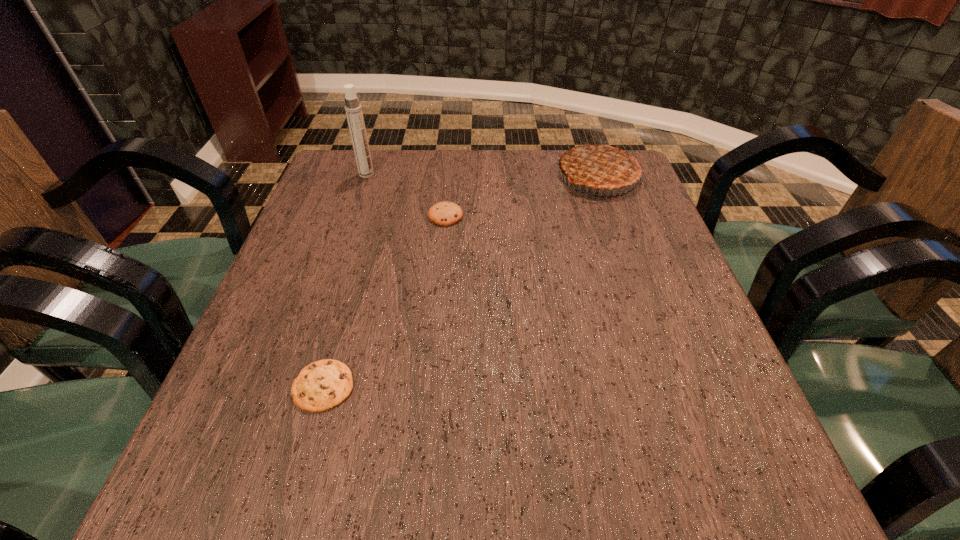
What are the coordinates of `free area in between the tallest object and the third tallest object` in the screenshot? It's located at (406, 195).

Where is `vacant region between the left cookie and the farther cookie`? This screenshot has width=960, height=540. vacant region between the left cookie and the farther cookie is located at coordinates pos(385,301).

This screenshot has width=960, height=540. In order to click on unoccupied area between the aerosol can and the pie in this screenshot , I will do `click(482, 176)`.

The width and height of the screenshot is (960, 540). I want to click on the closest object to the shorter cookie, so click(446, 213).

Identify the location of object that is the second closest to the tallest object. (604, 165).

The image size is (960, 540). Find the location of `free spot that satisfies the following two spatial constraints: 1. on the back side of the third farthest object; 2. on the left side of the third shortest object`. free spot that satisfies the following two spatial constraints: 1. on the back side of the third farthest object; 2. on the left side of the third shortest object is located at coordinates (449, 176).

Locate an element on the screen. This screenshot has height=540, width=960. free spot that satisfies the following two spatial constraints: 1. on the front side of the aerosol can; 2. on the right side of the shortest object is located at coordinates (296, 386).

This screenshot has width=960, height=540. I want to click on vacant space that satisfies the following two spatial constraints: 1. on the front side of the nearest object; 2. on the left side of the tallest object, so click(296, 386).

I want to click on vacant area in the image that satisfies the following two spatial constraints: 1. on the back side of the shorter cookie; 2. on the left side of the third farthest object, so click(x=372, y=215).

I want to click on vacant space that satisfies the following two spatial constraints: 1. on the back side of the pie; 2. on the left side of the taller cookie, so click(x=449, y=176).